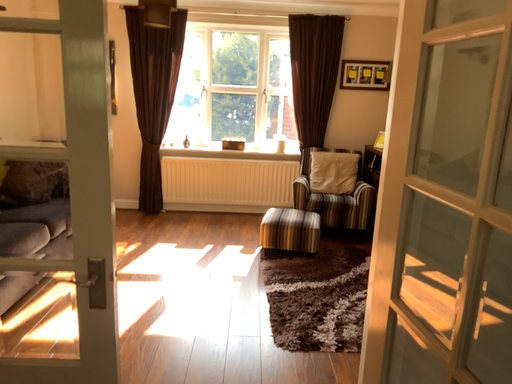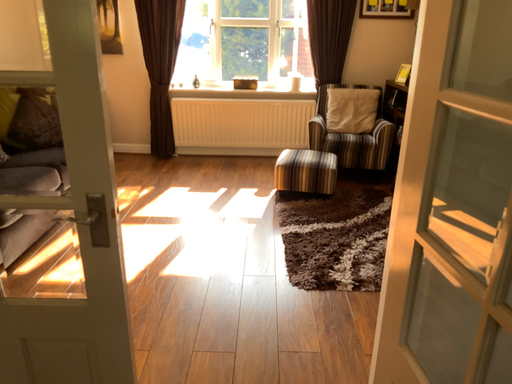
Question: How did the camera likely rotate when shooting the video?

Choices:
 (A) rotated upward
 (B) rotated downward

Answer: (B)